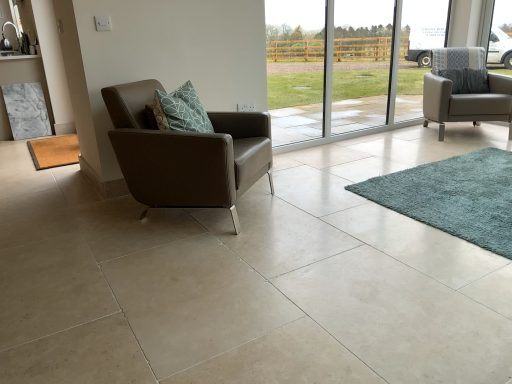
I want to click on free location to the right of brown leather armchair at left, which appears as the second chair when viewed from the right, so click(312, 202).